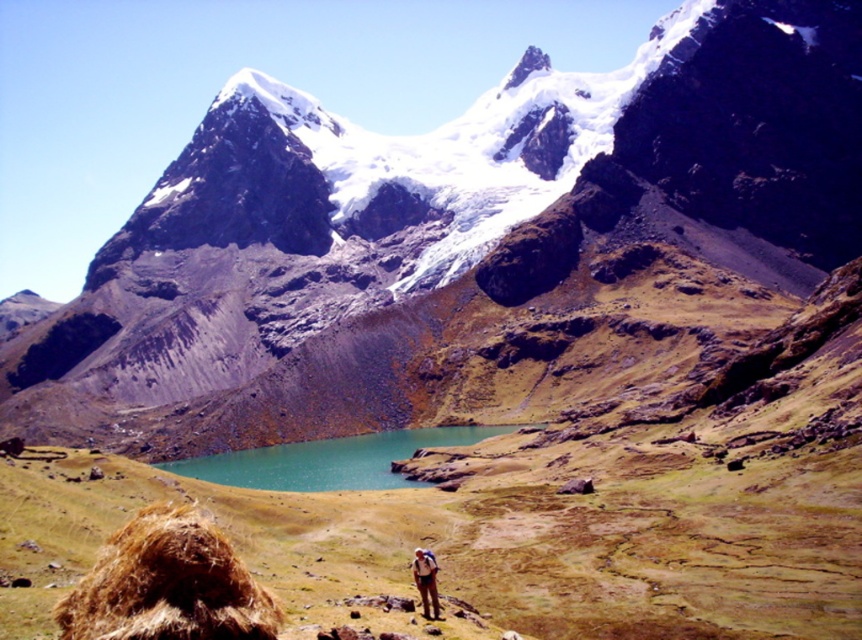
You are a hiker standing at point (380, 458) and want to move towards the rocky outcrop where the person is standing. Is the point (264, 118) in front of or behind your current position?

Point (264, 118) is behind point (380, 458), so the point (264, 118) is behind your current position.

You are a photographer planning to capture the rocky mountain range at center and the brown fabric pants at lower center in a single shot. Given that the camera can only focus on one subject clearly, which object should you prioritize to ensure it appears larger in your photo?

The rocky mountain range at center is bigger than the brown fabric pants at lower center, so you should prioritize focusing on the rocky mountain range at center to ensure it appears larger in the photo.